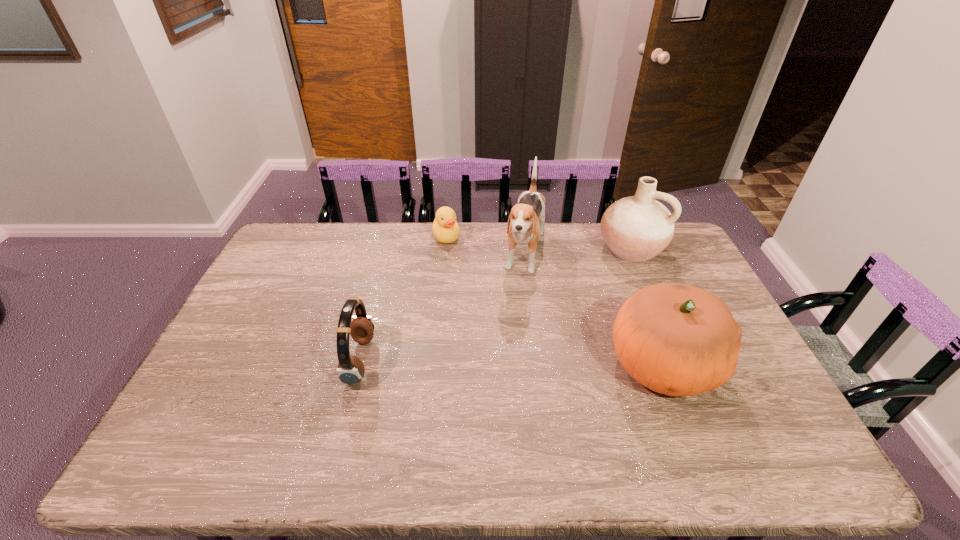
Where is `object that is at the near edge`? The height and width of the screenshot is (540, 960). object that is at the near edge is located at coordinates (679, 340).

Identify the location of pumpkin at the right edge. (679, 340).

Find the location of a particular element. The height and width of the screenshot is (540, 960). pottery present at the right edge is located at coordinates (637, 228).

Locate an element on the screen. The height and width of the screenshot is (540, 960). object that is at the far right corner is located at coordinates (637, 228).

You are a GUI agent. You are given a task and a screenshot of the screen. Output one action in this format:
    pyautogui.click(x=<x>, y=<y>)
    Task: Click on the object at the near right corner
    Image resolution: width=960 pixels, height=540 pixels.
    Given the screenshot: What is the action you would take?
    pyautogui.click(x=679, y=340)

At what (x,y) coordinates should I click in order to perform the action: click on vacant space at the far edge of the desktop. Please return your answer as a coordinate pair (x, y). Looking at the image, I should click on (430, 248).

Image resolution: width=960 pixels, height=540 pixels. In order to click on free space at the near edge of the desktop in this screenshot , I will do `click(409, 403)`.

This screenshot has width=960, height=540. I want to click on vacant space at the left edge of the desktop, so click(x=276, y=332).

The height and width of the screenshot is (540, 960). What are the coordinates of `vacant space at the right edge of the desktop` in the screenshot? It's located at (693, 263).

What are the coordinates of `blank space at the near left corner` in the screenshot? It's located at (238, 417).